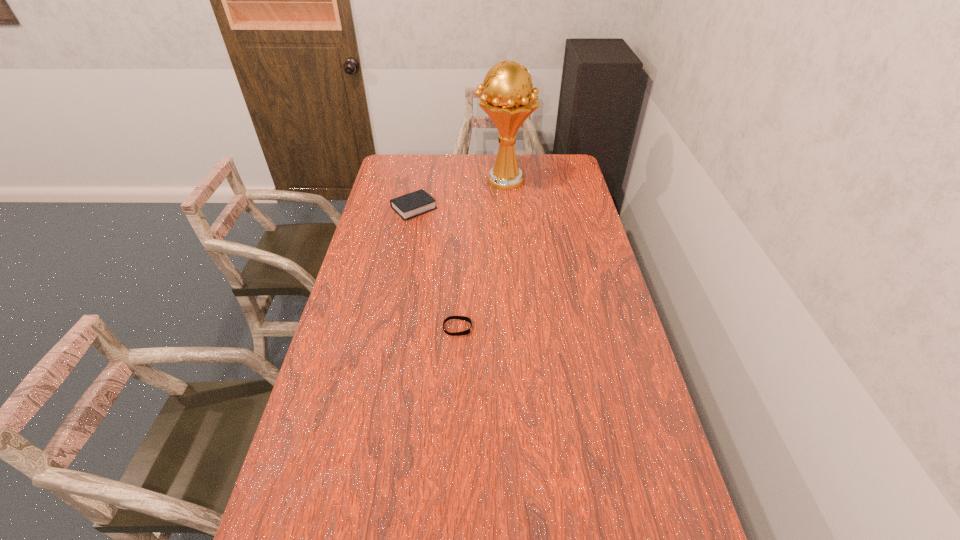
At what (x,y) coordinates should I click in order to perform the action: click on the farthest object. Please return your answer as a coordinate pair (x, y). The height and width of the screenshot is (540, 960). Looking at the image, I should click on (507, 100).

Identify the location of the rightmost object. Image resolution: width=960 pixels, height=540 pixels. (507, 100).

The image size is (960, 540). What are the coordinates of `the leftmost object` in the screenshot? It's located at (410, 205).

I want to click on the second tallest object, so click(410, 205).

Locate an element on the screen. the nearest object is located at coordinates (463, 318).

Find the location of a particular element. This screenshot has width=960, height=540. the second object from right to left is located at coordinates pos(463,318).

Find the location of `free space located at the front of the trophy_cup where the globe is prominent`. free space located at the front of the trophy_cup where the globe is prominent is located at coordinates (407, 180).

Locate an element on the screen. The width and height of the screenshot is (960, 540). blank area located at the front of the trophy_cup where the globe is prominent is located at coordinates (463, 180).

This screenshot has width=960, height=540. In order to click on free region located 0.190m at the front of the trophy_cup where the globe is prominent in this screenshot , I will do `click(435, 180)`.

What are the coordinates of `vacant space located 0.390m on the right of the leftmost object` in the screenshot? It's located at (528, 208).